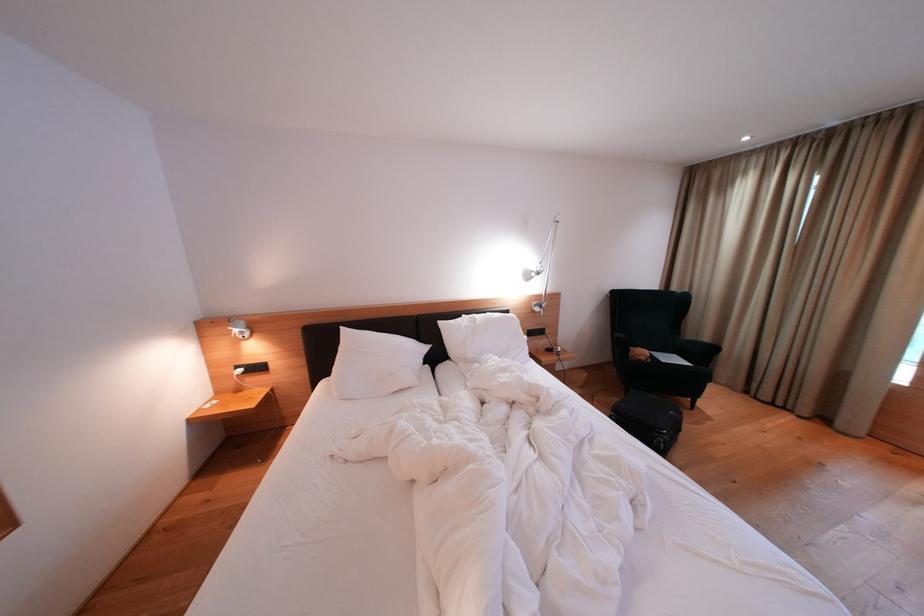
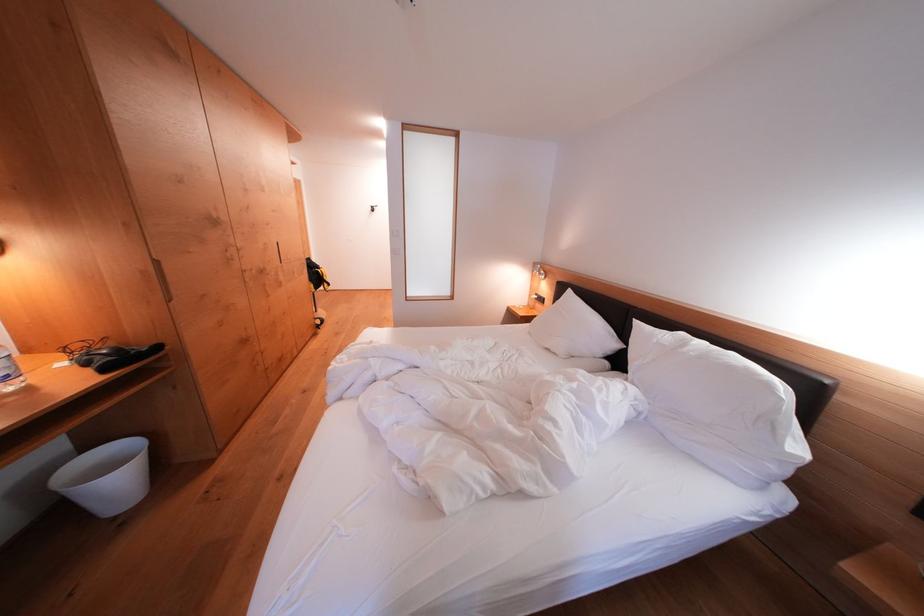
Where in the second image is the point corresponding to (447,328) from the first image?

(642, 326)